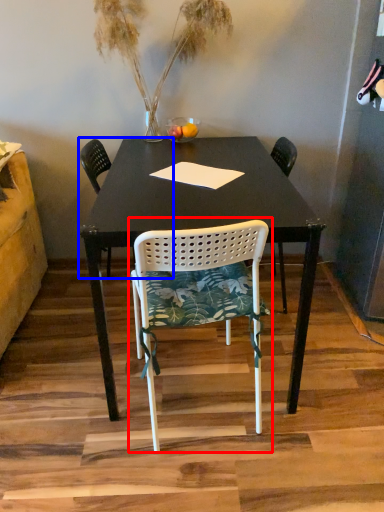
Question: Which of the following is the closest to the observer, chair (highlighted by a red box) or chair (highlighted by a blue box)?

Choices:
 (A) chair
 (B) chair

Answer: (A)